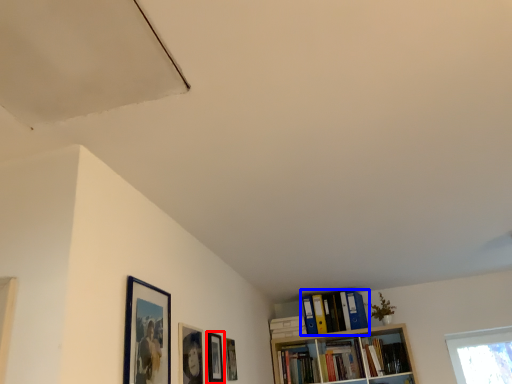
Question: Which point is closer to the camera, picture frame (highlighted by a red box) or book (highlighted by a blue box)?

Choices:
 (A) picture frame
 (B) book

Answer: (A)